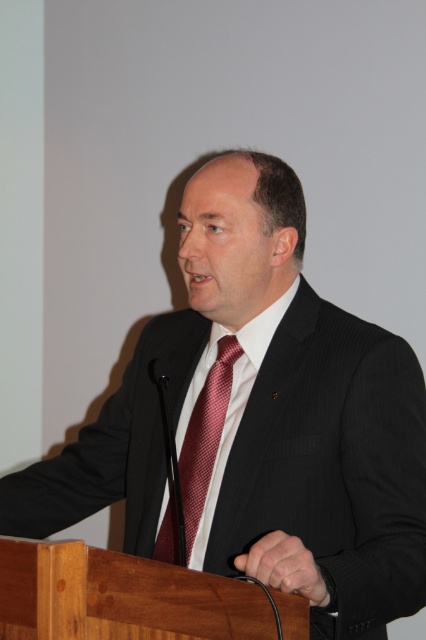
You are a photographer at the event and want to take a closeup photo of the shiny red tie at center without including the white smooth dress shirt at center. Is this possible given their positions?

The white smooth dress shirt at center is further to the viewer than shiny red tie at center. Therefore, the dress shirt is closer to the camera, blocking the view of the tie. It is not possible to capture the shiny red tie at center without including the white smooth dress shirt at center in the photo.

You are an event organizer and need to ensure the speaker is visible to the audience. Since the white smooth dress shirt at center and the shiny red tie at center are both at the center, which one is wider and might draw more attention?

The white smooth dress shirt at center is wider than the shiny red tie at center, so it might draw more attention.

You are attending a formal event and notice a man wearing a dark pinstripe suit. Can you tell me the position of the white smooth dress shirt at center relative to the shiny red tie at center?

The white smooth dress shirt at center is located above the shiny red tie at center.